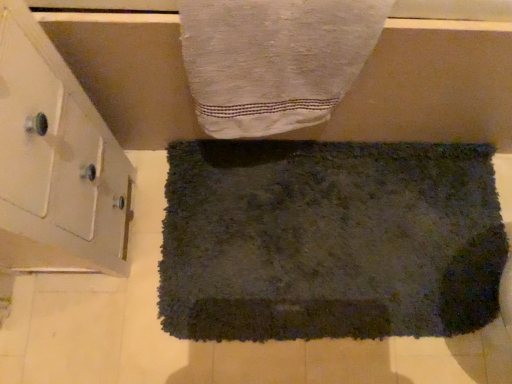
Image resolution: width=512 pixels, height=384 pixels. In order to click on white textured towel at upper center, the first towel positioned from the top in this screenshot , I will do `click(274, 60)`.

Describe the element at coordinates (329, 240) in the screenshot. I see `dark gray shaggy rug at center, arranged as the second towel when viewed from the front` at that location.

Find the location of a particular element. This screenshot has height=384, width=512. white glossy cabinet at left is located at coordinates (56, 161).

Identify the location of white textured towel at upper center, which is the second towel from bottom to top. (274, 60).

Between white glossy cabinet at left and dark gray shaggy rug at center, which is counted as the 2th towel, starting from the top, which one is positioned behind?

Positioned behind is dark gray shaggy rug at center, which is counted as the 2th towel, starting from the top.

Looking at this image, from the image's perspective, who appears lower, white glossy cabinet at left or dark gray shaggy rug at center, arranged as the second towel when viewed from the front?

dark gray shaggy rug at center, arranged as the second towel when viewed from the front.

Considering the positions of point (95, 210) and point (210, 228), is point (95, 210) closer or farther from the camera than point (210, 228)?

Point (95, 210).

Is white glossy cabinet at left turned away from dark gray shaggy rug at center, which is counted as the 2th towel, starting from the top?

That's not correct — white glossy cabinet at left is not looking away from dark gray shaggy rug at center, which is counted as the 2th towel, starting from the top.

Considering the relative sizes of white textured towel at upper center, placed as the second towel when sorted from back to front, and dark gray shaggy rug at center, arranged as the second towel when viewed from the front, in the image provided, is white textured towel at upper center, placed as the second towel when sorted from back to front, thinner than dark gray shaggy rug at center, arranged as the second towel when viewed from the front,?

Yes.

Is white textured towel at upper center, the first towel positioned from the top, positioned before dark gray shaggy rug at center, which appears as the 1th towel when ordered from the bottom?

Yes, the depth of white textured towel at upper center, the first towel positioned from the top, is less than that of dark gray shaggy rug at center, which appears as the 1th towel when ordered from the bottom.

Are white textured towel at upper center, the 1th towel in the front-to-back sequence, and dark gray shaggy rug at center, which appears as the 1th towel when ordered from the bottom, located far from each other?

Actually, white textured towel at upper center, the 1th towel in the front-to-back sequence, and dark gray shaggy rug at center, which appears as the 1th towel when ordered from the bottom, are a little close together.

Which is correct: white textured towel at upper center, which is the second towel from bottom to top, is inside dark gray shaggy rug at center, which is counted as the 2th towel, starting from the top, or outside of it?

white textured towel at upper center, which is the second towel from bottom to top, is outside dark gray shaggy rug at center, which is counted as the 2th towel, starting from the top.

The width and height of the screenshot is (512, 384). In order to click on towel that appears below the white textured towel at upper center, the 1th towel in the front-to-back sequence (from a real-world perspective) in this screenshot , I will do `click(329, 240)`.

From the image's perspective, is dark gray shaggy rug at center, arranged as the second towel when viewed from the front, on white textured towel at upper center, the 1th towel in the front-to-back sequence?

No.

Considering the positions of objects dark gray shaggy rug at center, positioned as the first towel in back-to-front order, and white textured towel at upper center, placed as the second towel when sorted from back to front, in the image provided, who is in front, dark gray shaggy rug at center, positioned as the first towel in back-to-front order, or white textured towel at upper center, placed as the second towel when sorted from back to front,?

white textured towel at upper center, placed as the second towel when sorted from back to front, is more forward.

Is dark gray shaggy rug at center, which is counted as the 2th towel, starting from the top, bigger than white textured towel at upper center, which is the second towel from bottom to top?

Yes.

Are white textured towel at upper center, the first towel positioned from the top, and white glossy cabinet at left far apart?

white textured towel at upper center, the first towel positioned from the top, is near white glossy cabinet at left, not far away.

What are the coordinates of `towel above the white glossy cabinet at left (from a real-world perspective)` in the screenshot? It's located at (274, 60).

Is white textured towel at upper center, the first towel positioned from the top, in front of or behind white glossy cabinet at left in the image?

white textured towel at upper center, the first towel positioned from the top, is positioned farther from the viewer than white glossy cabinet at left.

Is point (198, 35) in front of point (101, 224)?

Yes, point (198, 35) is in front of point (101, 224).

Are white glossy cabinet at left and white textured towel at upper center, the first towel positioned from the top, far apart?

That's not correct — white glossy cabinet at left is a little close to white textured towel at upper center, the first towel positioned from the top.

Between white glossy cabinet at left and white textured towel at upper center, the 1th towel in the front-to-back sequence, which one has less height?

white textured towel at upper center, the 1th towel in the front-to-back sequence, is shorter.

From the image's perspective, which is below, white glossy cabinet at left or white textured towel at upper center, the 1th towel in the front-to-back sequence?

white glossy cabinet at left appears lower in the image.

Is dark gray shaggy rug at center, arranged as the second towel when viewed from the front, aimed at white glossy cabinet at left?

No.

Is dark gray shaggy rug at center, positioned as the first towel in back-to-front order, not inside white glossy cabinet at left?

Yes.

Considering the sizes of dark gray shaggy rug at center, positioned as the first towel in back-to-front order, and white glossy cabinet at left in the image, is dark gray shaggy rug at center, positioned as the first towel in back-to-front order, taller or shorter than white glossy cabinet at left?

In the image, dark gray shaggy rug at center, positioned as the first towel in back-to-front order, appears to be shorter than white glossy cabinet at left.

Identify the location of towel that is under the white glossy cabinet at left (from a real-world perspective). (329, 240).

In the image, there is a white textured towel at upper center, which is the second towel from bottom to top. At what (x,y) coordinates should I click in order to perform the action: click on towel below it (from the image's perspective). Please return your answer as a coordinate pair (x, y). Looking at the image, I should click on (329, 240).

From the image, which object appears to be farther from white glossy cabinet at left, white textured towel at upper center, the 1th towel in the front-to-back sequence, or dark gray shaggy rug at center, arranged as the second towel when viewed from the front?

The object further to white glossy cabinet at left is dark gray shaggy rug at center, arranged as the second towel when viewed from the front.

Looking at the image, which one is located further to dark gray shaggy rug at center, positioned as the first towel in back-to-front order, white textured towel at upper center, which is the second towel from bottom to top, or white glossy cabinet at left?

Based on the image, white glossy cabinet at left appears to be further to dark gray shaggy rug at center, positioned as the first towel in back-to-front order.

Which object lies further to the anchor point white textured towel at upper center, the first towel positioned from the top, dark gray shaggy rug at center, which is counted as the 2th towel, starting from the top, or white glossy cabinet at left?

dark gray shaggy rug at center, which is counted as the 2th towel, starting from the top, is further to white textured towel at upper center, the first towel positioned from the top.

Looking at the image, which one is located closer to dark gray shaggy rug at center, arranged as the second towel when viewed from the front, white glossy cabinet at left or white textured towel at upper center, the first towel positioned from the top?

Among the two, white textured towel at upper center, the first towel positioned from the top, is located nearer to dark gray shaggy rug at center, arranged as the second towel when viewed from the front.

Based on their spatial positions, is dark gray shaggy rug at center, which is counted as the 2th towel, starting from the top, or white textured towel at upper center, placed as the second towel when sorted from back to front, further from white glossy cabinet at left?

The object further to white glossy cabinet at left is dark gray shaggy rug at center, which is counted as the 2th towel, starting from the top.

Looking at the image, which one is located closer to white textured towel at upper center, the 1th towel in the front-to-back sequence, white glossy cabinet at left or dark gray shaggy rug at center, positioned as the first towel in back-to-front order?

Based on the image, white glossy cabinet at left appears to be nearer to white textured towel at upper center, the 1th towel in the front-to-back sequence.

Find the location of a particular element. towel located between white glossy cabinet at left and dark gray shaggy rug at center, arranged as the second towel when viewed from the front, in the left-right direction is located at coordinates (274, 60).